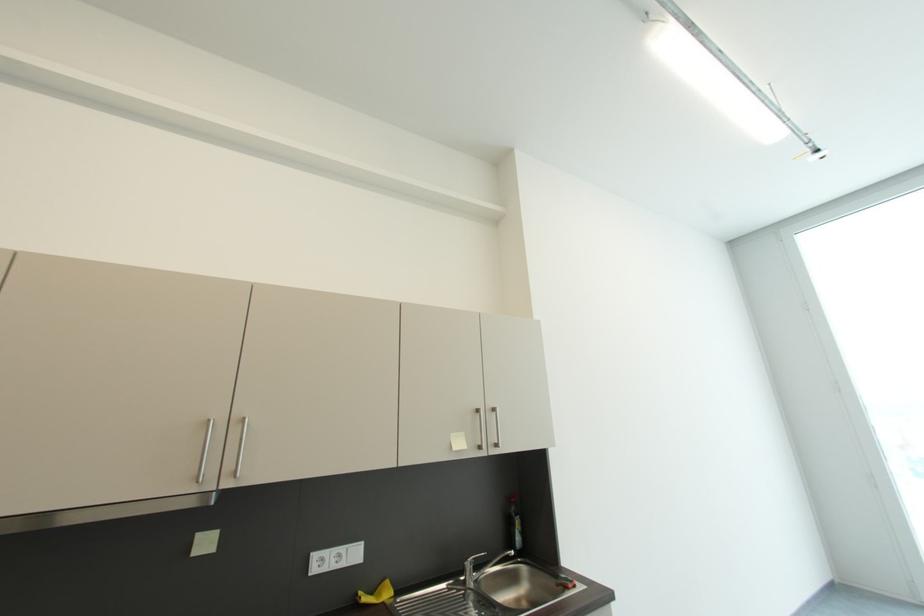
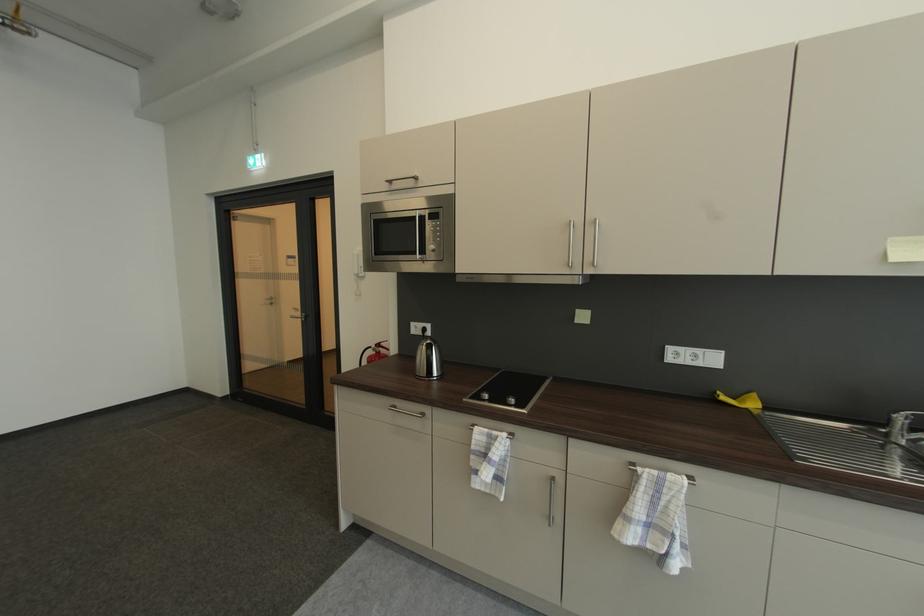
The images are taken continuously from a first-person perspective. In which direction is your viewpoint rotating?

The camera's rotation is toward left-down.